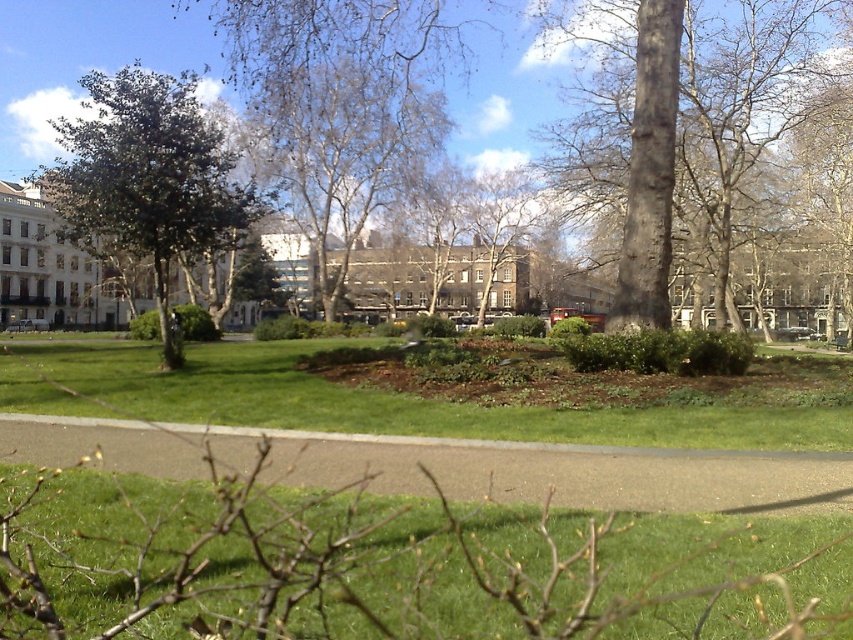
Can you confirm if green grass at lower center is positioned below smooth gray bark tree at center?

Indeed, green grass at lower center is positioned under smooth gray bark tree at center.

Does green grass at lower center lie behind smooth gray bark tree at center?

No, green grass at lower center is closer to the viewer.

Does point (691, 561) lie in front of point (593, 195)?

Yes, point (691, 561) is closer to viewer.

This screenshot has height=640, width=853. What are the coordinates of `green grass at lower center` in the screenshot? It's located at (403, 564).

Is green grassy area at center taller than green leafy tree at left?

In fact, green grassy area at center may be shorter than green leafy tree at left.

Is point (4, 376) less distant than point (94, 253)?

Yes, it is.

Image resolution: width=853 pixels, height=640 pixels. What do you see at coordinates (405, 400) in the screenshot? I see `green grassy area at center` at bounding box center [405, 400].

The width and height of the screenshot is (853, 640). I want to click on green grassy area at center, so click(405, 400).

Is point (651, 604) positioned after point (335, 92)?

No.

Is green grass at lower center closer to camera compared to bare white tree at center?

Yes, it is in front of bare white tree at center.

Find the location of a particular element. The image size is (853, 640). green grass at lower center is located at coordinates (403, 564).